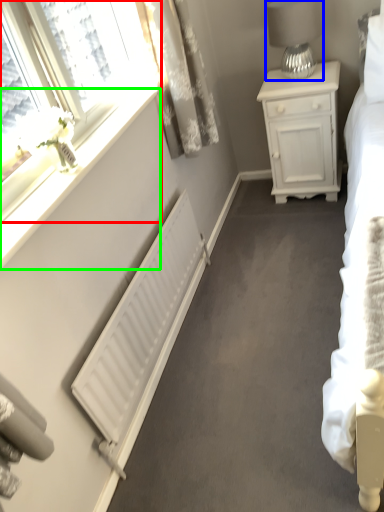
Question: Considering the real-world distances, which object is farthest from window (highlighted by a red box)? table lamp (highlighted by a blue box) or window sill (highlighted by a green box)?

Choices:
 (A) table lamp
 (B) window sill

Answer: (A)